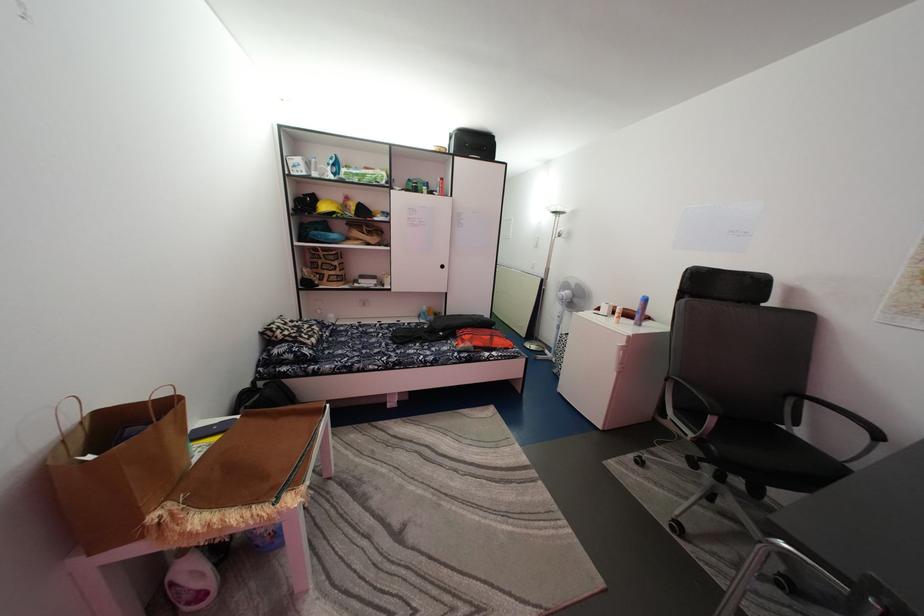
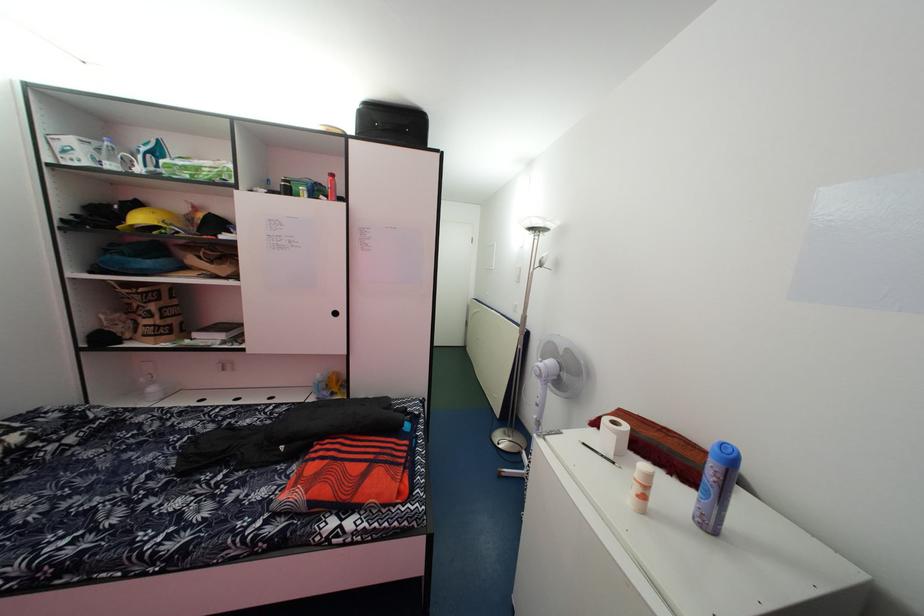
The point at (653,307) is marked in the first image. Where is the corresponding point in the second image?

(738, 466)